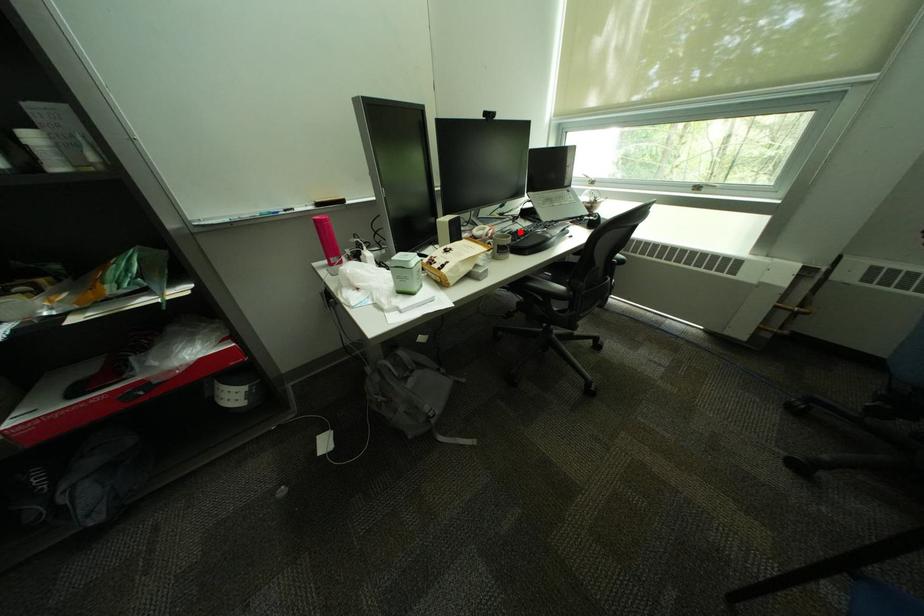
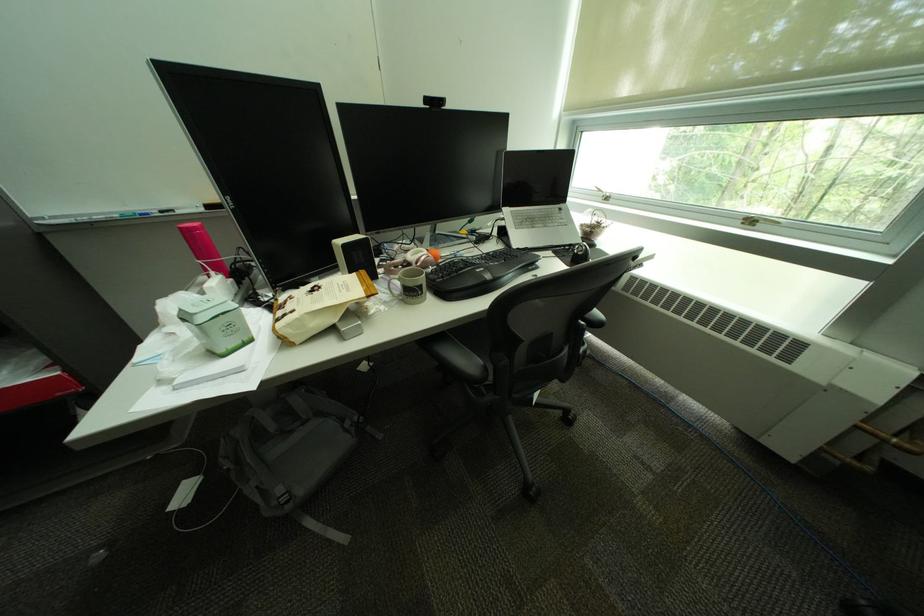
The point at the highlighted location is marked in the first image. Where is the corresponding point in the second image?

(463, 261)